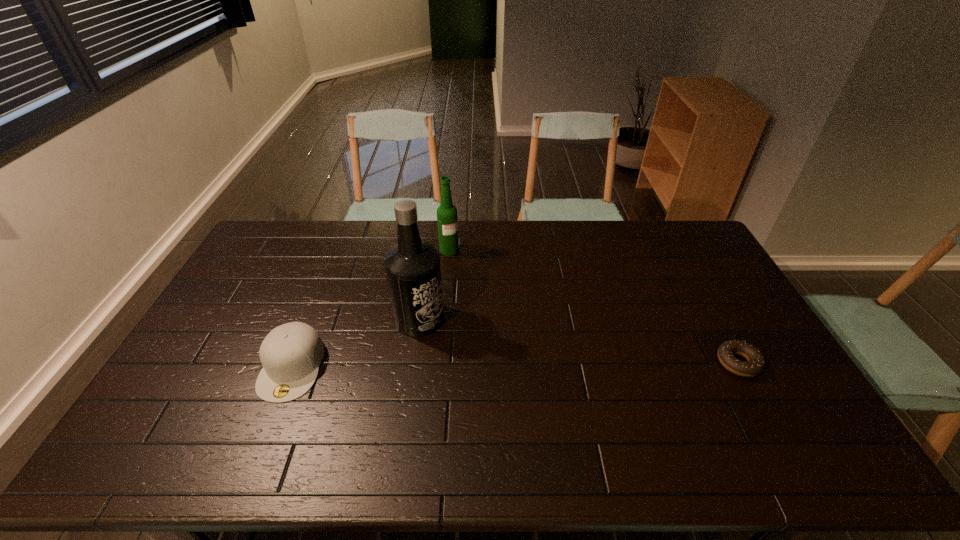
Identify the location of vacant space on the desktop that is between the second shortest object and the rightmost object and is positioned on the front label of the tallest object. (521, 364).

This screenshot has height=540, width=960. Identify the location of free spot on the desktop that is between the third tallest object and the shortest object and is positioned on the label of the farthest object. (558, 364).